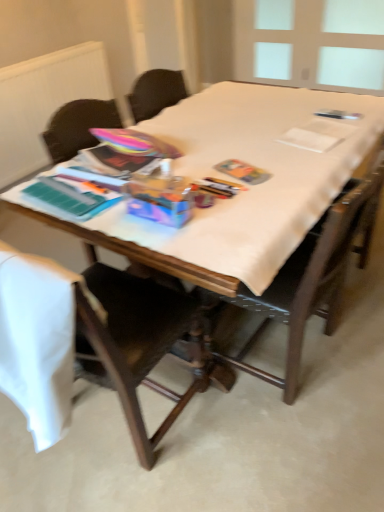
Measure the distance between point [329,42] and camera.

Point [329,42] is 3.79 meters away from camera.

Measure the distance between point (246, 150) and camera.

The distance of point (246, 150) from camera is 5.15 feet.

Describe the element at coordinates (249, 187) in the screenshot. I see `wooden table at center` at that location.

Locate an element on the screen. wooden chair at center, placed as the 1th chair when sorted from right to left is located at coordinates (311, 277).

In the image, there is a wooden chair at center, placed as the 2th chair when sorted from left to right. Identify the location of table above it (from the image's perspective). This screenshot has width=384, height=512. (249, 187).

Is wooden table at center positioned beyond the bounds of wooden chair at center, placed as the 1th chair when sorted from right to left?

Absolutely, wooden table at center is external to wooden chair at center, placed as the 1th chair when sorted from right to left.

How much distance is there between wooden table at center and wooden chair at center, placed as the 1th chair when sorted from right to left?

They are 15.57 inches apart.

Between wooden table at center and wooden chair at center, placed as the 2th chair when sorted from left to right, which one appears on the left side from the viewer's perspective?

Positioned to the left is wooden table at center.

Image resolution: width=384 pixels, height=512 pixels. What are the coordinates of `the 2nd chair located beneath the white matte radiator at upper left (from a real-world perspective)` in the screenshot? It's located at (126, 338).

From the image's perspective, is wooden chair at left, which is the 2th chair in right-to-left order, below white matte radiator at upper left?

Indeed, from the image's perspective, wooden chair at left, which is the 2th chair in right-to-left order, is shown beneath white matte radiator at upper left.

Between wooden chair at left, which is the 2th chair in right-to-left order, and white matte radiator at upper left, which one appears on the right side from the viewer's perspective?

wooden chair at left, which is the 2th chair in right-to-left order.

Looking at this image, from a real-world perspective, between wooden chair at left, which is the 2th chair in right-to-left order, and wooden chair at center, placed as the 1th chair when sorted from right to left, who is vertically lower?

wooden chair at left, which is the 2th chair in right-to-left order, is physically lower.

Considering the relative sizes of wooden chair at left, which is the 2th chair in right-to-left order, and wooden chair at center, placed as the 1th chair when sorted from right to left, in the image provided, is wooden chair at left, which is the 2th chair in right-to-left order, thinner than wooden chair at center, placed as the 1th chair when sorted from right to left,?

Incorrect, the width of wooden chair at left, which is the 2th chair in right-to-left order, is not less than that of wooden chair at center, placed as the 1th chair when sorted from right to left.

In the image, is wooden chair at left, which is the 2th chair in right-to-left order, positioned in front of or behind wooden chair at center, placed as the 2th chair when sorted from left to right?

Visually, wooden chair at left, which is the 2th chair in right-to-left order, is located in front of wooden chair at center, placed as the 2th chair when sorted from left to right.

Is wooden chair at left, which is the 2th chair in right-to-left order, facing towards wooden chair at center, placed as the 2th chair when sorted from left to right?

No, wooden chair at left, which is the 2th chair in right-to-left order, is not oriented towards wooden chair at center, placed as the 2th chair when sorted from left to right.

Is transparent plastic window screen at upper right at the right side of wooden chair at left, which is the 2th chair in right-to-left order?

Yes, transparent plastic window screen at upper right is to the right of wooden chair at left, which is the 2th chair in right-to-left order.

Does transparent plastic window screen at upper right lie in front of wooden chair at left, the first chair when ordered from left to right?

No, transparent plastic window screen at upper right is behind wooden chair at left, the first chair when ordered from left to right.

Is wooden chair at left, which is the 2th chair in right-to-left order, at the back of transparent plastic window screen at upper right?

No, wooden chair at left, which is the 2th chair in right-to-left order, is not at the back of transparent plastic window screen at upper right.

Which is in front, point (360, 36) or point (158, 386)?

The point (158, 386) is closer to the camera.

Is white matte radiator at upper left inside or outside of wooden table at center?

The correct answer is: outside.

At what (x,y) coordinates should I click in order to perform the action: click on table in front of the white matte radiator at upper left. Please return your answer as a coordinate pair (x, y). Image resolution: width=384 pixels, height=512 pixels. Looking at the image, I should click on (249, 187).

Considering the relative positions of white matte radiator at upper left and wooden table at center in the image provided, is white matte radiator at upper left to the left or to the right of wooden table at center?

white matte radiator at upper left is positioned on wooden table at center's left side.

Is point (64, 90) farther from viewer compared to point (245, 211)?

Yes, it is behind point (245, 211).

Could you tell me if wooden chair at center, placed as the 2th chair when sorted from left to right, is facing wooden table at center?

Yes, wooden chair at center, placed as the 2th chair when sorted from left to right, is oriented towards wooden table at center.

Measure the distance from wooden chair at center, placed as the 2th chair when sorted from left to right, to wooden table at center.

wooden chair at center, placed as the 2th chair when sorted from left to right, is 39.55 centimeters away from wooden table at center.

Considering the points (248, 350) and (186, 157), which point is behind, point (248, 350) or point (186, 157)?

Point (248, 350)

From the image's perspective, which one is positioned higher, wooden chair at center, placed as the 1th chair when sorted from right to left, or wooden chair at left, the first chair when ordered from left to right?

From the image's view, wooden chair at center, placed as the 1th chair when sorted from right to left, is above.

Looking at this image, which of these two, wooden chair at center, placed as the 1th chair when sorted from right to left, or wooden chair at left, which is the 2th chair in right-to-left order, is thinner?

wooden chair at center, placed as the 1th chair when sorted from right to left.

Is wooden chair at center, placed as the 2th chair when sorted from left to right, to the right of wooden chair at left, the first chair when ordered from left to right, from the viewer's perspective?

Indeed, wooden chair at center, placed as the 2th chair when sorted from left to right, is positioned on the right side of wooden chair at left, the first chair when ordered from left to right.

Is wooden chair at left, the first chair when ordered from left to right, inside wooden chair at center, placed as the 1th chair when sorted from right to left?

No.

The width and height of the screenshot is (384, 512). Identify the location of table beneath the wooden chair at center, placed as the 2th chair when sorted from left to right (from a real-world perspective). (249, 187).

Find the location of a particular element. Image resolution: width=384 pixels, height=512 pixels. radiator above the wooden chair at left, the first chair when ordered from left to right (from the image's perspective) is located at coordinates (44, 102).

Looking at the image, which one is located further to transparent plastic window screen at upper right, wooden table at center or white matte radiator at upper left?

Among the two, wooden table at center is located further to transparent plastic window screen at upper right.

Looking at the image, which one is located closer to wooden table at center, transparent plastic window screen at upper right or white matte radiator at upper left?

The object closer to wooden table at center is white matte radiator at upper left.

Which object lies further to the anchor point white matte radiator at upper left, wooden chair at center, placed as the 2th chair when sorted from left to right, or wooden table at center?

wooden chair at center, placed as the 2th chair when sorted from left to right, is further to white matte radiator at upper left.

Which object lies further to the anchor point white matte radiator at upper left, transparent plastic window screen at upper right or wooden chair at left, the first chair when ordered from left to right?

wooden chair at left, the first chair when ordered from left to right, lies further to white matte radiator at upper left than the other object.

When comparing their distances from wooden table at center, does white matte radiator at upper left or transparent plastic window screen at upper right seem further?

transparent plastic window screen at upper right.

In the scene shown: From the image, which object appears to be nearer to wooden chair at left, which is the 2th chair in right-to-left order, wooden chair at center, placed as the 2th chair when sorted from left to right, or white matte radiator at upper left?

wooden chair at center, placed as the 2th chair when sorted from left to right, lies closer to wooden chair at left, which is the 2th chair in right-to-left order, than the other object.

Looking at the image, which one is located further to wooden chair at center, placed as the 2th chair when sorted from left to right, wooden table at center or transparent plastic window screen at upper right?

transparent plastic window screen at upper right.

Looking at the image, which one is located further to wooden chair at center, placed as the 1th chair when sorted from right to left, wooden chair at left, which is the 2th chair in right-to-left order, or transparent plastic window screen at upper right?

transparent plastic window screen at upper right lies further to wooden chair at center, placed as the 1th chair when sorted from right to left, than the other object.

Find the location of `radiator between wooden chair at left, which is the 2th chair in right-to-left order, and transparent plastic window screen at upper right from front to back`. radiator between wooden chair at left, which is the 2th chair in right-to-left order, and transparent plastic window screen at upper right from front to back is located at coordinates click(x=44, y=102).

Find the location of `table between wooden chair at left, the first chair when ordered from left to right, and wooden chair at center, placed as the 2th chair when sorted from left to right, in the horizontal direction`. table between wooden chair at left, the first chair when ordered from left to right, and wooden chair at center, placed as the 2th chair when sorted from left to right, in the horizontal direction is located at coordinates (249, 187).

Image resolution: width=384 pixels, height=512 pixels. Identify the location of table between wooden chair at left, the first chair when ordered from left to right, and white matte radiator at upper left in the front-back direction. (249, 187).

The image size is (384, 512). What are the coordinates of `table positioned between wooden chair at center, placed as the 1th chair when sorted from right to left, and transparent plastic window screen at upper right from near to far` in the screenshot? It's located at (249, 187).